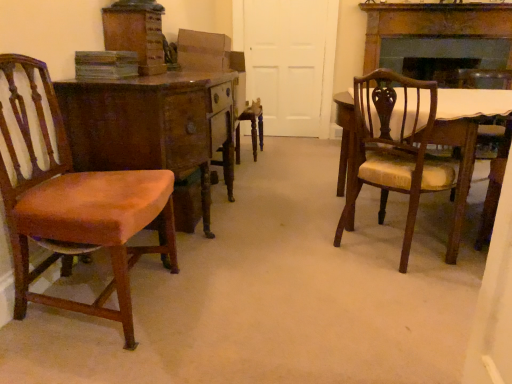
Locate an element on the screen. This screenshot has width=512, height=384. free spot to the right of wooden desk at left is located at coordinates (285, 222).